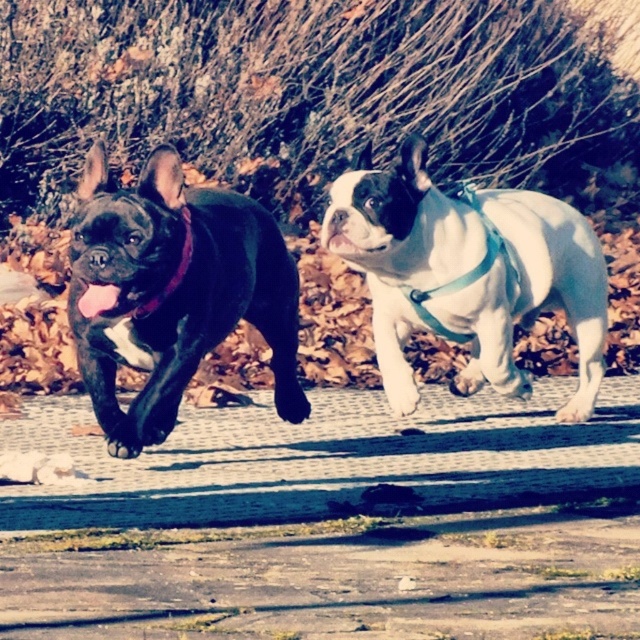
You are a photographer standing at the point marked by the coordinates point at (186, 276). You want to take a photo of the two French Bulldogs that are 3.69 meters apart. What is the minimum distance you need to move backward to ensure both dogs are fully in the frame?

Since the two French Bulldogs are 3.69 meters apart, you need to move backward at least 3.69 meters to ensure both dogs are fully in the frame.